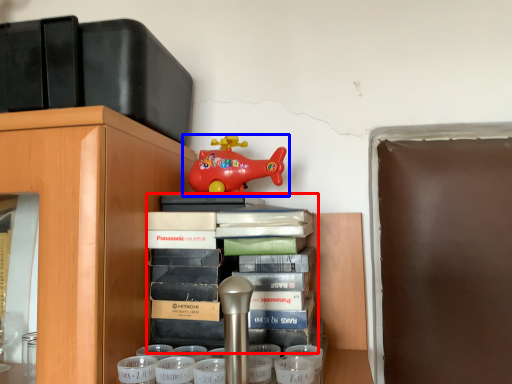
Question: Which object is further to the camera taking this photo, book (highlighted by a red box) or toy (highlighted by a blue box)?

Choices:
 (A) book
 (B) toy

Answer: (B)